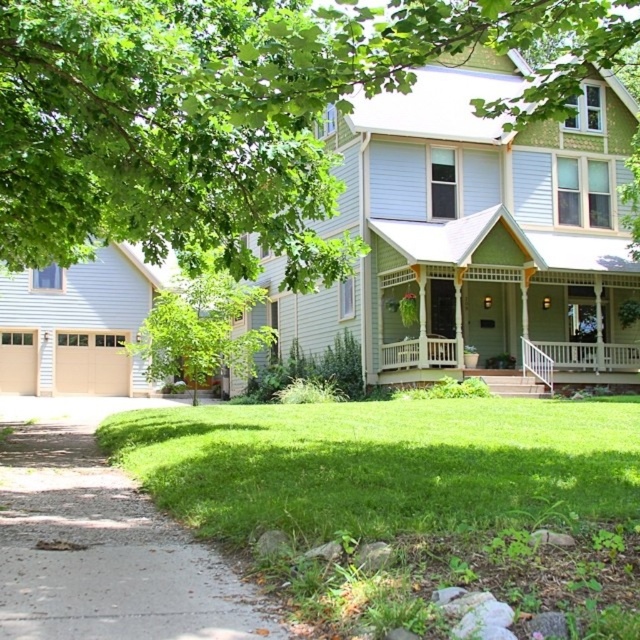
Question: Which object is positioned farthest from the white wooden porch at center?

Choices:
 (A) gray concrete path at lower left
 (B) green leafy tree at center

Answer: (A)

Question: Is green grass at lower center to the left of green leafy tree at center from the viewer's perspective?

Choices:
 (A) no
 (B) yes

Answer: (A)

Question: Does gray concrete path at lower left lie in front of green leafy tree at center?

Choices:
 (A) yes
 (B) no

Answer: (A)

Question: Is green leafy tree at center further to the viewer compared to white wooden porch at center?

Choices:
 (A) no
 (B) yes

Answer: (A)

Question: Which of the following is the farthest from the observer?

Choices:
 (A) click(x=308, y=608)
 (B) click(x=435, y=340)

Answer: (B)

Question: Which object appears closest to the camera in this image?

Choices:
 (A) gray concrete path at lower left
 (B) green leafy tree at upper left

Answer: (A)